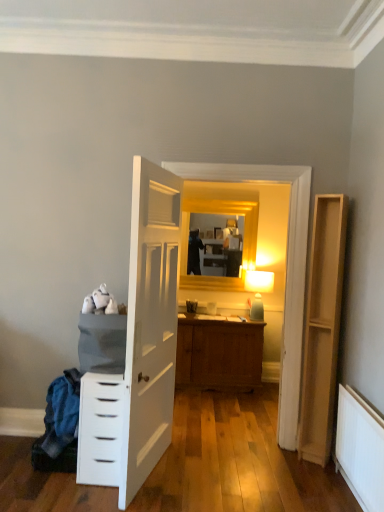
Locate an element on the screen. free space between white glossy chest of drawers at left and light brown wood file cabinet at right is located at coordinates (223, 465).